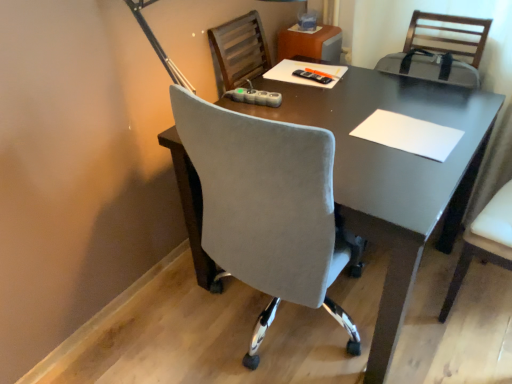
In order to click on free location to the right of black plastic remote control at center in this screenshot , I will do `click(356, 77)`.